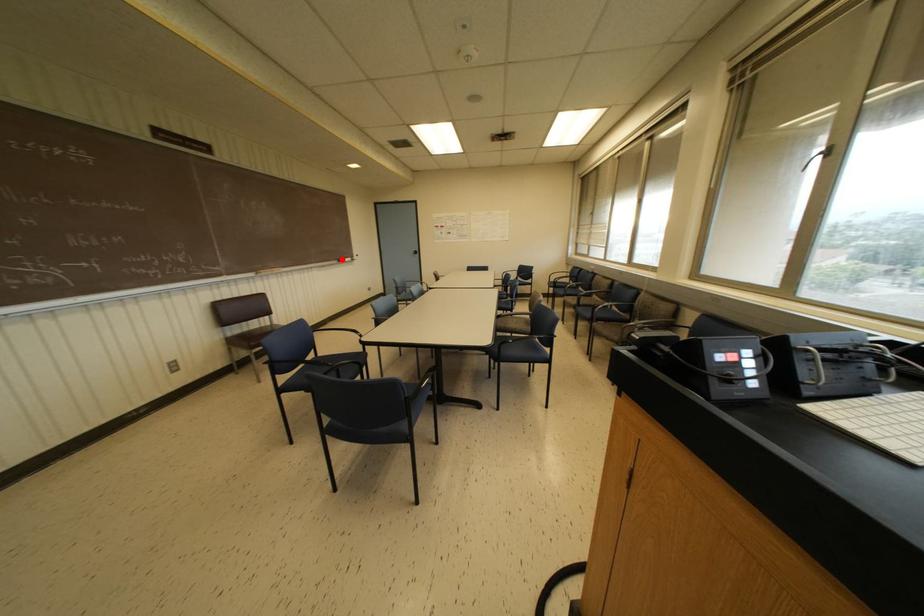
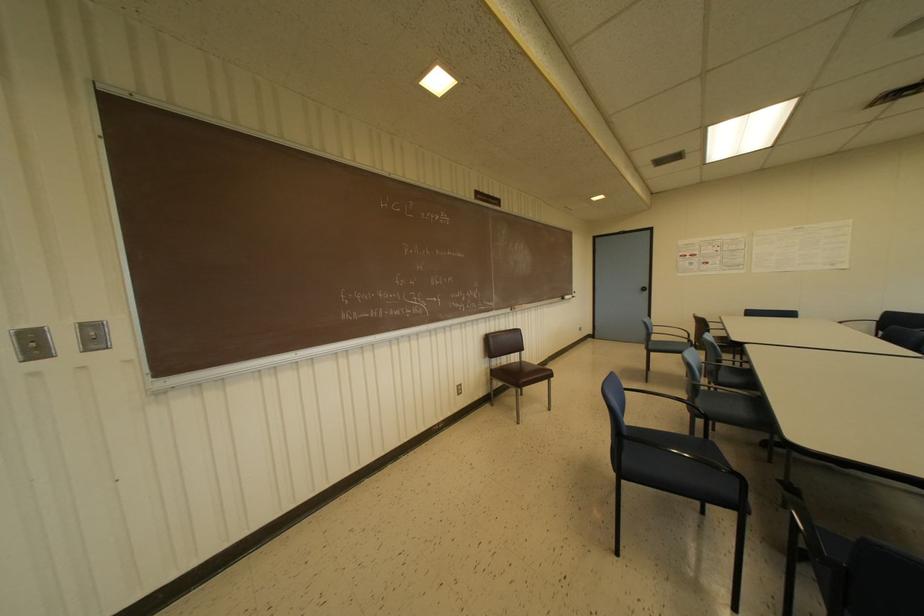
Find the pixel in the second image that matches the highlighted location in the first image.

(565, 296)